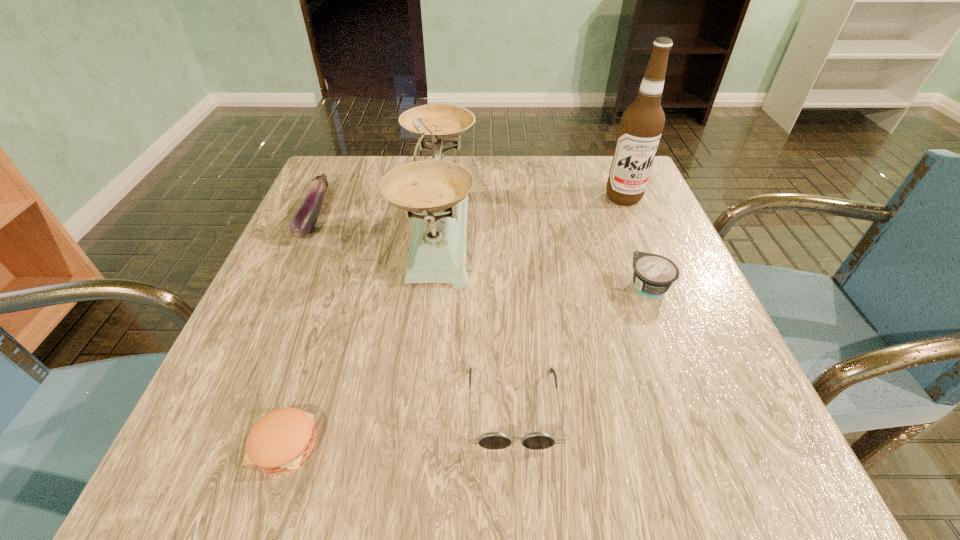
This screenshot has height=540, width=960. I want to click on free space at the far right corner, so click(621, 210).

Locate an element on the screen. free space at the near right corner of the desktop is located at coordinates (726, 434).

Identify the location of empty location between the tallest object and the leftmost object. (468, 206).

Identify the location of unoccupied area between the alcohol and the leftmost object. This screenshot has height=540, width=960. (468, 206).

The image size is (960, 540). Find the location of `free spot between the second object from left to right and the alcohol`. free spot between the second object from left to right and the alcohol is located at coordinates (454, 321).

Where is `vacant space that's between the patty and the scale`? The image size is (960, 540). vacant space that's between the patty and the scale is located at coordinates (362, 335).

The width and height of the screenshot is (960, 540). What are the coordinates of `free space between the scale and the patty` in the screenshot? It's located at (362, 335).

Locate an element on the screen. The image size is (960, 540). vacant area that lies between the leftmost object and the alcohol is located at coordinates (468, 206).

Locate an element on the screen. The height and width of the screenshot is (540, 960). free spot between the scale and the fifth object from right to left is located at coordinates (362, 335).

Locate an element on the screen. This screenshot has height=540, width=960. free space between the sunglasses and the alcohol is located at coordinates (x=568, y=302).